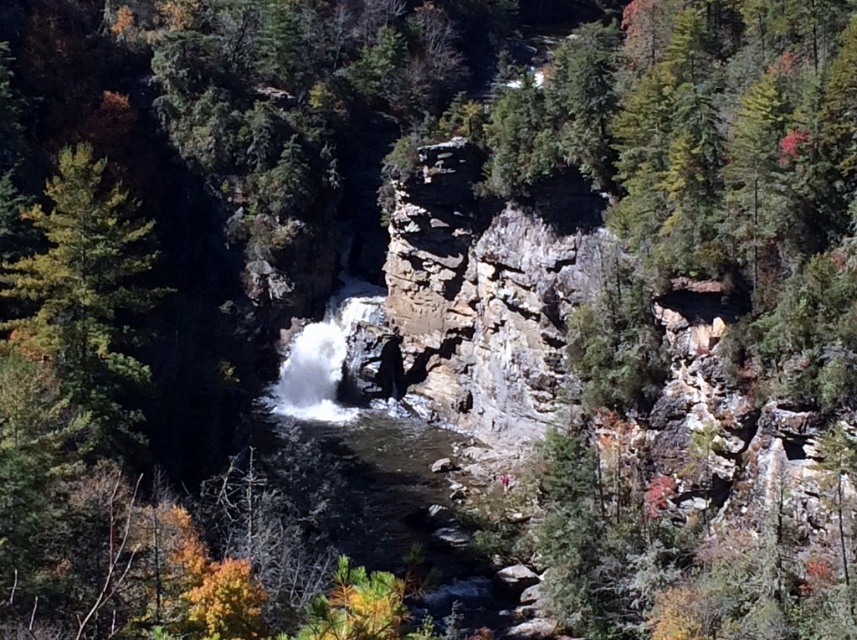
Can you confirm if green matte tree at left is smaller than white frothy water at center?

Incorrect, green matte tree at left is not smaller in size than white frothy water at center.

Describe the element at coordinates (87, 294) in the screenshot. Image resolution: width=857 pixels, height=640 pixels. I see `green matte tree at left` at that location.

At what (x,y) coordinates should I click in order to perform the action: click on green matte tree at left. Please return your answer as a coordinate pair (x, y). Image resolution: width=857 pixels, height=640 pixels. Looking at the image, I should click on (87, 294).